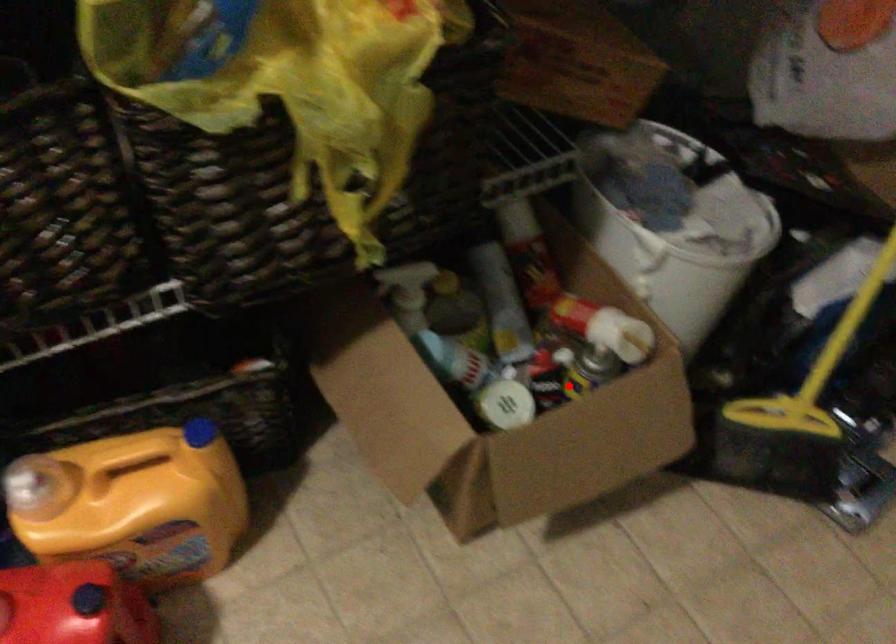
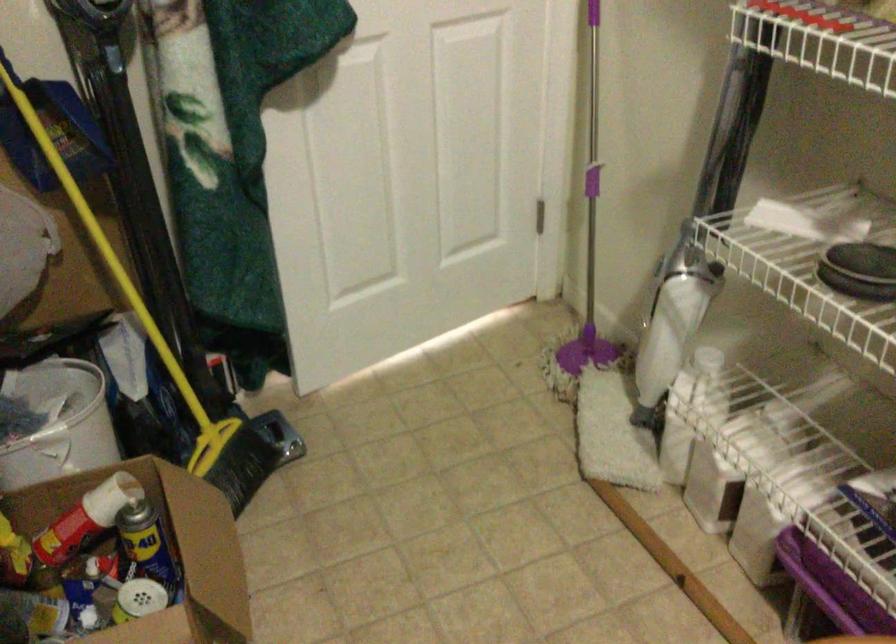
Question: A red point is marked in image1. In image2, is the corresponding 3D point closer to the camera or farther? Reply with the corresponding letter.

Choices:
 (A) The corresponding 3D point is closer.
 (B) The corresponding 3D point is farther.

Answer: (B)